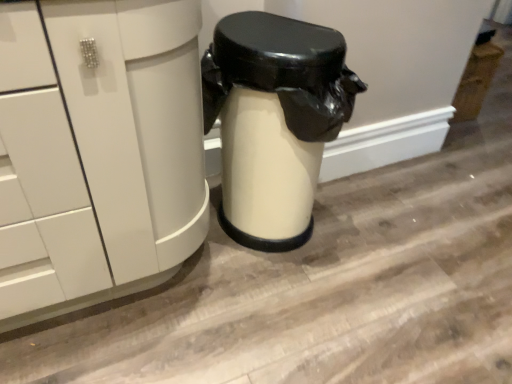
Where is `vacant space to the right of white glossy trash can at center`? The width and height of the screenshot is (512, 384). vacant space to the right of white glossy trash can at center is located at coordinates (391, 244).